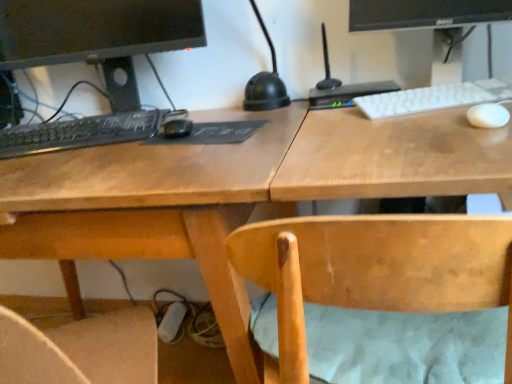
This screenshot has width=512, height=384. Find the location of `vacant position to the left of white matte mouse at upper right`. vacant position to the left of white matte mouse at upper right is located at coordinates (389, 130).